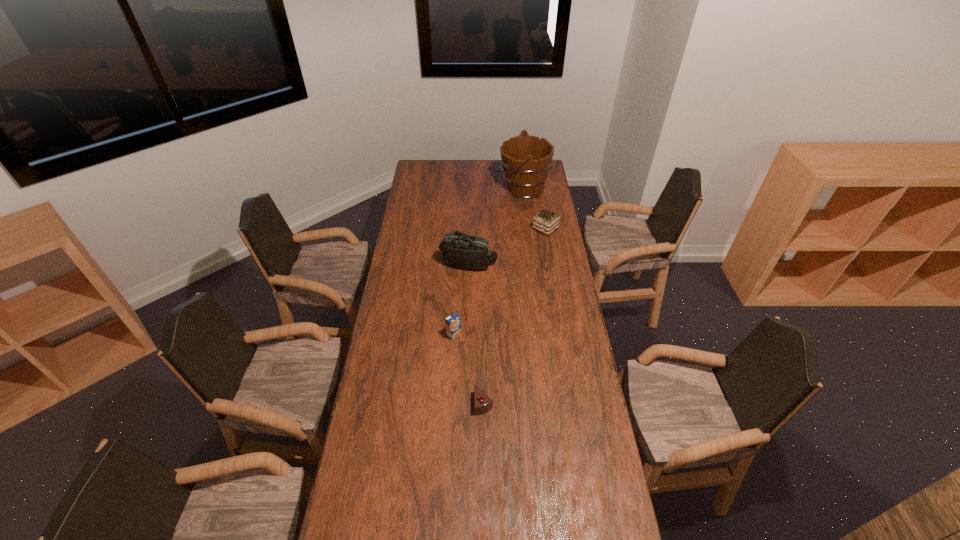
Find the location of a particular element. The height and width of the screenshot is (540, 960). the farthest object is located at coordinates (525, 160).

The image size is (960, 540). What are the coordinates of `wine bucket` in the screenshot? It's located at (525, 160).

Identify the location of shoulder bag. The height and width of the screenshot is (540, 960). (459, 250).

Image resolution: width=960 pixels, height=540 pixels. I want to click on the second tallest object, so click(x=459, y=250).

Where is `orange_juice`? The width and height of the screenshot is (960, 540). orange_juice is located at coordinates (453, 322).

Find the location of a particular element. Image resolution: width=960 pixels, height=540 pixels. the farther chocolate cake is located at coordinates (546, 221).

Locate an element on the screen. Image resolution: width=960 pixels, height=540 pixels. the taller chocolate cake is located at coordinates (x=546, y=221).

You are a GUI agent. You are given a task and a screenshot of the screen. Output one action in this format:
    pyautogui.click(x=<x>, y=<y>)
    Task: Click on the shortest object
    
    Given the screenshot: What is the action you would take?
    pyautogui.click(x=483, y=403)

This screenshot has height=540, width=960. Identify the location of the nearer chocolate cake. (483, 403).

Locate an element on the screen. vacant area located 0.090m with the handle on the wine bucket is located at coordinates (483, 188).